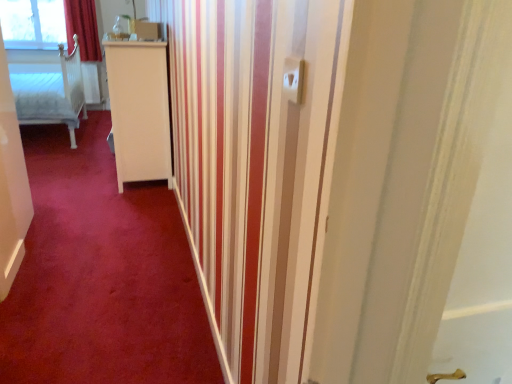
The width and height of the screenshot is (512, 384). Describe the element at coordinates (293, 79) in the screenshot. I see `white plastic electric outlet at upper center` at that location.

Describe the element at coordinates (50, 91) in the screenshot. This screenshot has height=384, width=512. I see `white wooden bed at left` at that location.

Where is `transparent glass window at upper left`? This screenshot has width=512, height=384. transparent glass window at upper left is located at coordinates (33, 24).

Are red carpet at center and red velvet curtain at upper left far apart?

Yes, red carpet at center is far from red velvet curtain at upper left.

Considering the sizes of objects red carpet at center and red velvet curtain at upper left in the image provided, who is shorter, red carpet at center or red velvet curtain at upper left?

red carpet at center.

Is red carpet at center situated inside red velvet curtain at upper left or outside?

red carpet at center lies outside red velvet curtain at upper left.

In terms of height, does white plastic electric outlet at upper center look taller or shorter compared to red carpet at center?

white plastic electric outlet at upper center is taller than red carpet at center.

Consider the image. Considering the relative positions of white plastic electric outlet at upper center and red carpet at center in the image provided, is white plastic electric outlet at upper center in front of red carpet at center?

Yes, it is in front of red carpet at center.

Which of these two, white plastic electric outlet at upper center or red carpet at center, is thinner?

Thinner between the two is white plastic electric outlet at upper center.

From the image's perspective, which is above, white plastic electric outlet at upper center or transparent glass window at upper left?

From the image's view, transparent glass window at upper left is above.

Does white plastic electric outlet at upper center turn towards transparent glass window at upper left?

No, white plastic electric outlet at upper center is not turned towards transparent glass window at upper left.

Does point (286, 70) come in front of point (50, 46)?

Yes, it is in front of point (50, 46).

From a real-world perspective, which object rests below the other?

transparent glass window at upper left, from a real-world perspective.

Which point is more distant from viewer, (7, 24) or (110, 337)?

Positioned behind is point (7, 24).

From the image's perspective, which one is positioned higher, transparent glass window at upper left or red carpet at center?

From the image's view, transparent glass window at upper left is above.

How far apart are transparent glass window at upper left and red carpet at center?

They are 10.77 feet apart.

From a real-world perspective, which is physically below, transparent glass window at upper left or red carpet at center?

red carpet at center, from a real-world perspective.

Considering their positions, is red carpet at center located in front of or behind white plastic electric outlet at upper center?

red carpet at center is behind white plastic electric outlet at upper center.

Is the surface of red carpet at center in direct contact with white plastic electric outlet at upper center?

No.

How many degrees apart are the facing directions of red carpet at center and white plastic electric outlet at upper center?

The angular difference between red carpet at center and white plastic electric outlet at upper center is 90.7 degrees.

How much distance is there between red carpet at center and white plastic electric outlet at upper center?

7.47 feet.

Does point (26, 24) appear closer or farther from the camera than point (94, 35)?

Point (26, 24) is positioned closer to the camera compared to point (94, 35).

Is transparent glass window at upper left looking in the opposite direction of red velvet curtain at upper left?

transparent glass window at upper left does not have its back to red velvet curtain at upper left.

Considering the sizes of transparent glass window at upper left and red velvet curtain at upper left in the image, is transparent glass window at upper left taller or shorter than red velvet curtain at upper left?

transparent glass window at upper left is shorter than red velvet curtain at upper left.

Is transparent glass window at upper left further to the viewer compared to red velvet curtain at upper left?

Yes, transparent glass window at upper left is further from the viewer.

Does red carpet at center lie in front of white wooden bed at left?

Yes, the depth of red carpet at center is less than that of white wooden bed at left.

Considering the relative positions of red carpet at center and white wooden bed at left in the image provided, is red carpet at center to the right of white wooden bed at left from the viewer's perspective?

Yes.

What's the angular difference between red carpet at center and white wooden bed at left's facing directions?

89.4 degrees.

Considering the relative sizes of red carpet at center and white wooden bed at left in the image provided, is red carpet at center taller than white wooden bed at left?

No.

In order to click on plain below the red velvet curtain at upper left (from the image's perspective) in this screenshot , I will do `click(101, 275)`.

The image size is (512, 384). I want to click on electric outlet in front of the red carpet at center, so click(x=293, y=79).

Looking at the image, which one is located closer to white wooden bed at left, red velvet curtain at upper left or white plastic electric outlet at upper center?

red velvet curtain at upper left is closer to white wooden bed at left.

Based on the photo, looking at the image, which one is located closer to white wooden bed at left, red carpet at center or red velvet curtain at upper left?

Based on the image, red velvet curtain at upper left appears to be nearer to white wooden bed at left.

Estimate the real-world distances between objects in this image. Which object is closer to red velvet curtain at upper left, white wooden bed at left or transparent glass window at upper left?

The object closer to red velvet curtain at upper left is transparent glass window at upper left.

When comparing their distances from white plastic electric outlet at upper center, does transparent glass window at upper left or red velvet curtain at upper left seem closer?

red velvet curtain at upper left is closer to white plastic electric outlet at upper center.

Considering their positions, is red carpet at center positioned further to white plastic electric outlet at upper center than red velvet curtain at upper left?

red velvet curtain at upper left.

Based on their spatial positions, is transparent glass window at upper left or red carpet at center further from white plastic electric outlet at upper center?

transparent glass window at upper left lies further to white plastic electric outlet at upper center than the other object.

Considering their positions, is white wooden bed at left positioned closer to transparent glass window at upper left than white plastic electric outlet at upper center?

white wooden bed at left is positioned closer to the anchor transparent glass window at upper left.

Which object lies further to the anchor point red carpet at center, transparent glass window at upper left or white plastic electric outlet at upper center?

transparent glass window at upper left is positioned further to the anchor red carpet at center.

You are a GUI agent. You are given a task and a screenshot of the screen. Output one action in this format:
    pyautogui.click(x=<x>, y=<y>)
    Task: Click on the furniture between white plastic electric outlet at upper center and red velvet curtain at upper left in the front-back direction
    The width and height of the screenshot is (512, 384).
    Given the screenshot: What is the action you would take?
    pyautogui.click(x=50, y=91)

Where is `curtain between white wooden bed at left and transparent glass window at upper left in the front-back direction`? curtain between white wooden bed at left and transparent glass window at upper left in the front-back direction is located at coordinates (83, 29).

I want to click on curtain between red carpet at center and transparent glass window at upper left in the front-back direction, so click(x=83, y=29).

Identify the location of curtain between white plastic electric outlet at upper center and transparent glass window at upper left in the front-back direction. (83, 29).